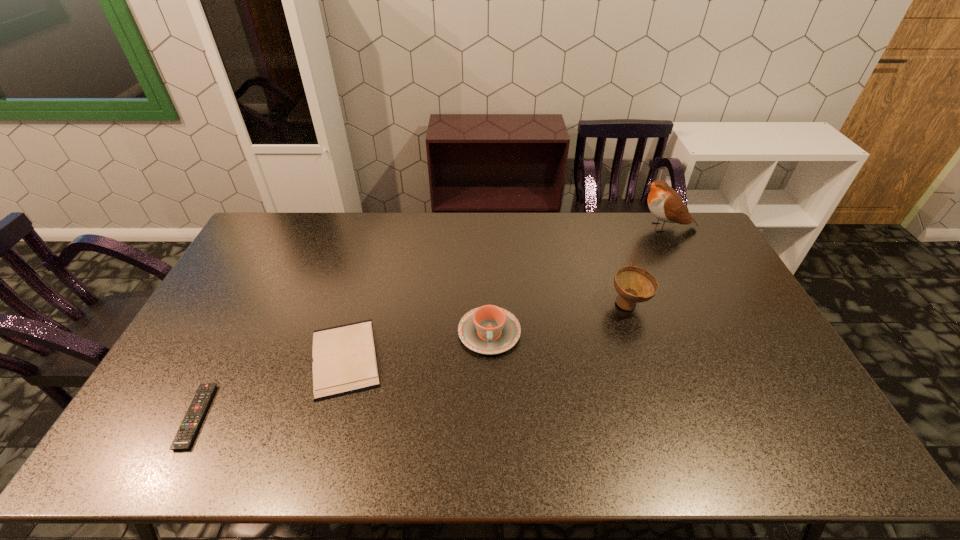
You are a GUI agent. You are given a task and a screenshot of the screen. Output one action in this format:
    pyautogui.click(x=<x>, y=<y>)
    Task: Click on the free space located 0.380m at the face of the tallest object
    
    Given the screenshot: What is the action you would take?
    point(536,227)

This screenshot has height=540, width=960. Find the location of `free space located 0.050m at the face of the tallest object`. free space located 0.050m at the face of the tallest object is located at coordinates (621, 227).

Identify the location of vacant region located 0.180m at the face of the tallest object. (588, 227).

Locate an element on the screen. Image resolution: width=960 pixels, height=540 pixels. vacant space positioned on the left of the fourth object from left to right is located at coordinates (583, 305).

Where is `vacant position located 0.150m on the handle side of the chinaware`? This screenshot has width=960, height=540. vacant position located 0.150m on the handle side of the chinaware is located at coordinates (491, 405).

This screenshot has width=960, height=540. Identify the location of vacant area situated 0.110m on the right of the hardback book. (425, 357).

Image resolution: width=960 pixels, height=540 pixels. I want to click on blank space located on the left of the leftmost object, so click(146, 416).

You are a GUI agent. You are given a task and a screenshot of the screen. Output one action in this format:
    pyautogui.click(x=<x>, y=<y>)
    Task: Click on the object present at the far edge
    The height and width of the screenshot is (540, 960).
    Given the screenshot: What is the action you would take?
    pyautogui.click(x=664, y=202)

This screenshot has height=540, width=960. What are the coordinates of `object that is at the near edge` in the screenshot? It's located at click(x=185, y=435).

At what (x,y) coordinates should I click in order to perform the action: click on object positioned at the left edge. Please return your answer as a coordinate pair (x, y). Looking at the image, I should click on [x=185, y=435].